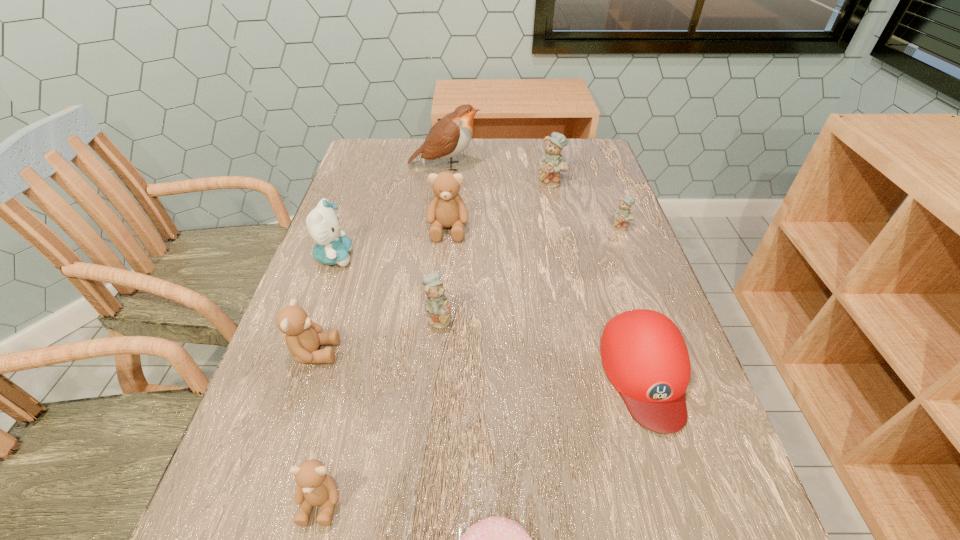
Where is `vacant position located on the front-facing side of the fourth farthest teddy bear`? Image resolution: width=960 pixels, height=540 pixels. vacant position located on the front-facing side of the fourth farthest teddy bear is located at coordinates coord(482,318).

Where is `free space located 0.140m on the front-facing side of the second nearest brown teddy bear`? The width and height of the screenshot is (960, 540). free space located 0.140m on the front-facing side of the second nearest brown teddy bear is located at coordinates (411, 352).

Image resolution: width=960 pixels, height=540 pixels. I want to click on vacant space located 0.080m on the front-facing side of the baseball cap, so click(682, 488).

Find the location of `free spot located 0.280m on the front-facing side of the rightmost blue teddy bear`. free spot located 0.280m on the front-facing side of the rightmost blue teddy bear is located at coordinates (654, 316).

Locate an element on the screen. bird that is at the far edge is located at coordinates (450, 136).

In order to click on teddy bear that is at the far edge in this screenshot , I will do `click(552, 162)`.

Identify the location of kitten that is positioned at the left edge. (323, 225).

Identify the location of baseball cap that is at the right edge. The width and height of the screenshot is (960, 540). (644, 355).

I want to click on object situated at the far right corner, so click(552, 162).

Where is `vacant area at the left edge`? This screenshot has width=960, height=540. vacant area at the left edge is located at coordinates [x=384, y=184].